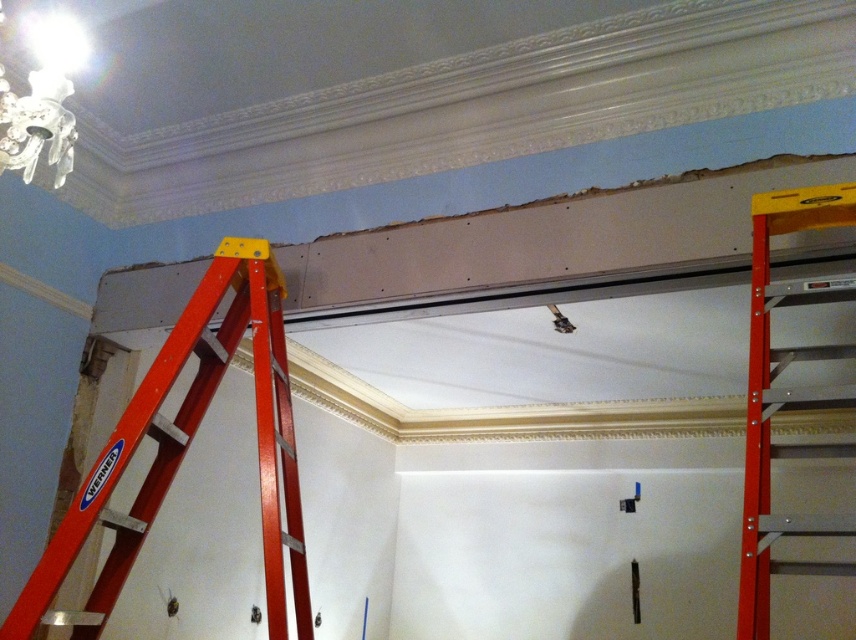
You are a construction worker in the room. You need to reach the hole in the ceiling. The ladder is at center. Where should you place the ladder to reach the hole? The ladder is a red Werner ladder positioned against the wall. The hole is near the center of the ceiling. The point at coordinates point (788, 396) is on the ladder. The ladder is metallic orange. The hole is in the ceiling. The ladder is at center. The hole is near the center of the ceiling. The ladder is at center. The hole is in the ceiling

The point at coordinates point (788, 396) is on the metallic orange ladder at center, so placing the ladder directly under the hole near the center of the ceiling would allow access to it.

You are a construction worker in the room. You need to move the metallic orange ladder at center to the left side of the room. Which direction should you move it relative to the matte white chandelier at upper left?

The metallic orange ladder at center is currently to the right of the matte white chandelier at upper left. To move it to the left side of the room, you should move it towards the left, away from the chandelier.

You are a contractor assessing the room. You need to determine if the metallic orange ladder at center can reach the matte white chandelier at upper left. Can it?

The metallic orange ladder at center has a greater height compared to matte white chandelier at upper left, so yes, the ladder can reach the chandelier.